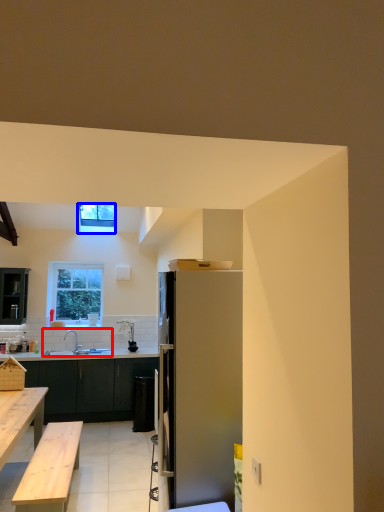
Question: Which object appears closest to the camera in this image, sink (highlighted by a red box) or window (highlighted by a blue box)?

Choices:
 (A) sink
 (B) window

Answer: (B)